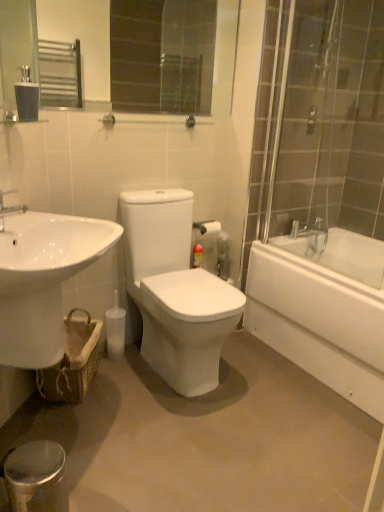
Question: From a real-world perspective, is silver metallic faucet at upper left physically below matte black tissue at upper left?

Choices:
 (A) yes
 (B) no

Answer: (A)

Question: Is silver metallic faucet at upper left not inside matte black tissue at upper left?

Choices:
 (A) yes
 (B) no

Answer: (A)

Question: Can you confirm if silver metallic faucet at upper left is taller than matte black tissue at upper left?

Choices:
 (A) no
 (B) yes

Answer: (A)

Question: Is silver metallic faucet at upper left oriented away from matte black tissue at upper left?

Choices:
 (A) yes
 (B) no

Answer: (B)

Question: Can matte black tissue at upper left be found inside silver metallic faucet at upper left?

Choices:
 (A) yes
 (B) no

Answer: (B)

Question: From a real-world perspective, is silver metallic faucet at upper left over matte black tissue at upper left?

Choices:
 (A) yes
 (B) no

Answer: (B)

Question: Is matte black tissue at upper left with silver metallic faucet at upper left?

Choices:
 (A) yes
 (B) no

Answer: (B)

Question: Does matte black tissue at upper left have a lesser width compared to silver metallic faucet at upper left?

Choices:
 (A) no
 (B) yes

Answer: (B)

Question: From the image's perspective, is matte black tissue at upper left below silver metallic faucet at upper left?

Choices:
 (A) no
 (B) yes

Answer: (A)

Question: From a real-world perspective, is matte black tissue at upper left located beneath silver metallic faucet at upper left?

Choices:
 (A) no
 (B) yes

Answer: (A)

Question: From a real-world perspective, does matte black tissue at upper left stand above silver metallic faucet at upper left?

Choices:
 (A) yes
 (B) no

Answer: (A)

Question: Is matte black tissue at upper left positioned far away from silver metallic faucet at upper left?

Choices:
 (A) no
 (B) yes

Answer: (A)

Question: Is silver metallic faucet at upper left oriented away from white glossy sink at lower left?

Choices:
 (A) yes
 (B) no

Answer: (B)